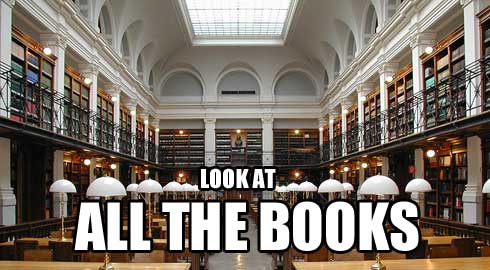
Where is `square areas on ceiling letting light through`? square areas on ceiling letting light through is located at coordinates (210, 12), (250, 16), (215, 2), (252, 2), (219, 32), (251, 25).